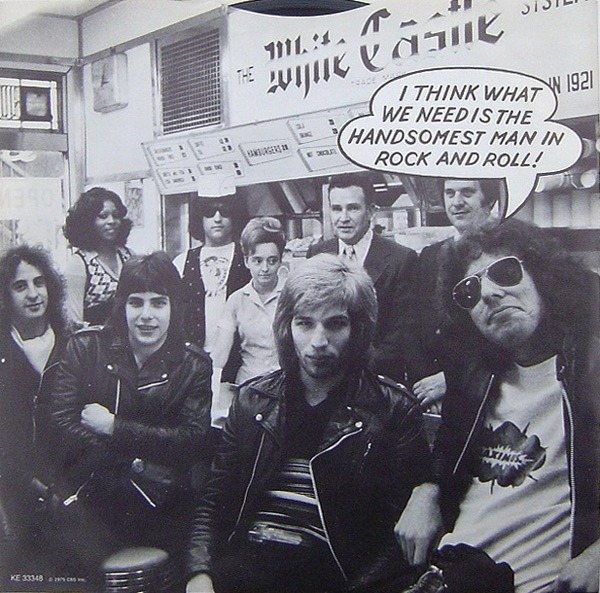
The width and height of the screenshot is (600, 593). I want to click on clock, so click(106, 84).